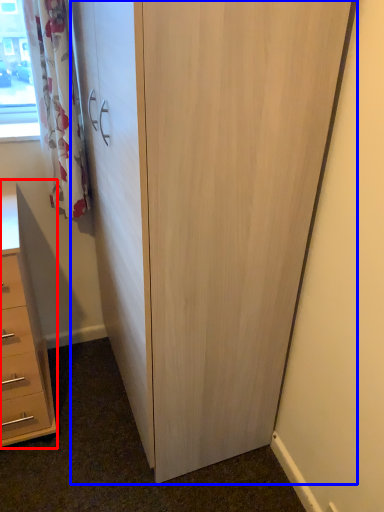
Question: Which of the following is the closest to the observer, chest of drawers (highlighted by a red box) or cupboard (highlighted by a blue box)?

Choices:
 (A) chest of drawers
 (B) cupboard

Answer: (B)